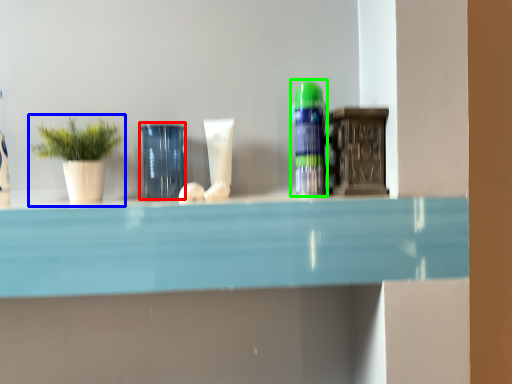
Question: Estimate the real-world distances between objects in this image. Which object is closer to glass vase (highlighted by a red box), houseplant (highlighted by a blue box) or toiletry (highlighted by a green box)?

Choices:
 (A) houseplant
 (B) toiletry

Answer: (A)